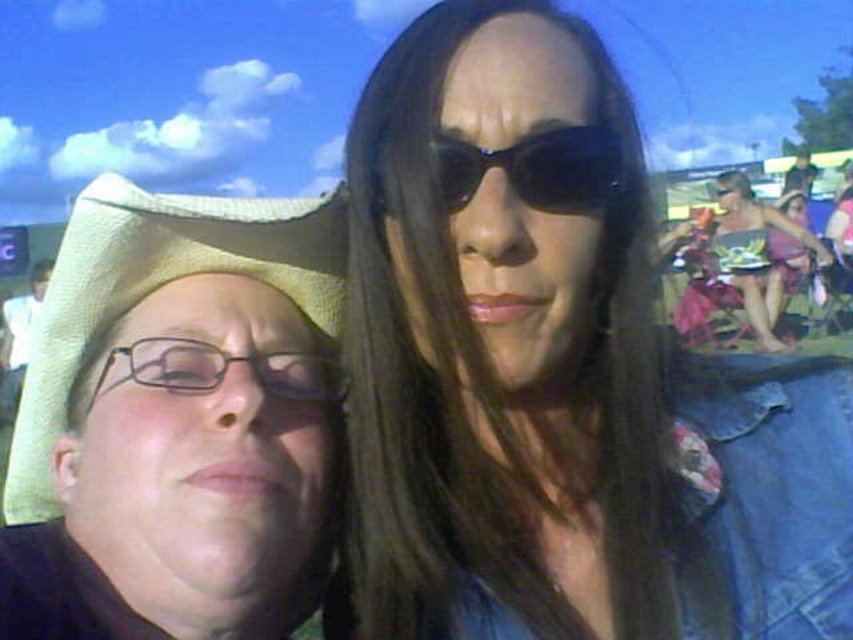
You are a photographer trying to focus on the clear plastic glasses at center and the patterned fabric bikini top at right. Which object should you adjust your camera focus to first if you want to capture both in one shot?

You should focus on the clear plastic glasses at center first because it is closer to the viewer than the patterned fabric bikini top at right, so adjusting focus starting from the closer object ensures both are in focus when using depth of field techniques.

You are taking a photo of two people standing close together. You notice the black shiny sunglasses at center and the clear plastic glasses at center. Which one is blocking the view of the other?

The black shiny sunglasses at center is in front of clear plastic glasses at center, so it is blocking the view of the clear plastic glasses at center.